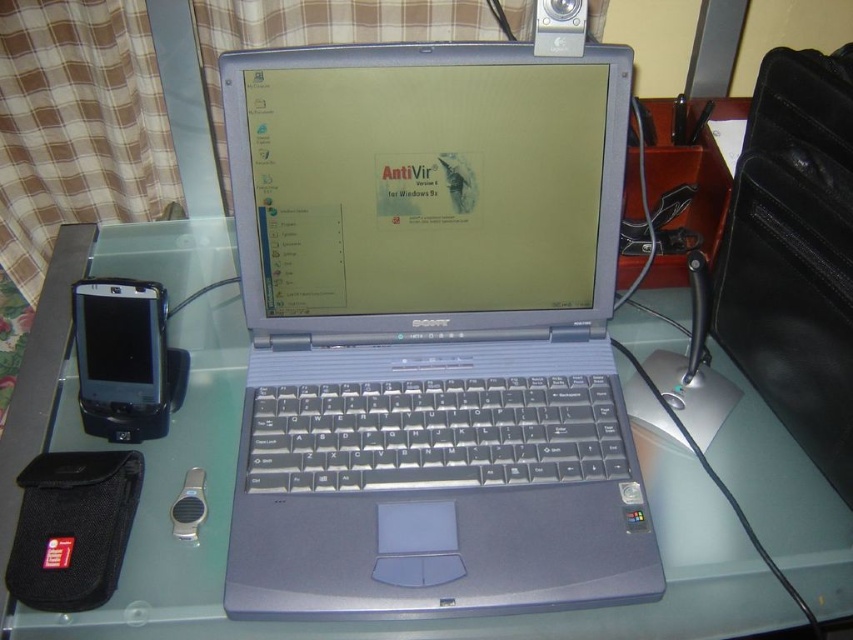
You are setting up a new monitor that requires 15 cm of vertical space. Based on the workspace shown, will the silver metallic laptop at center and the clear glass table at center provide enough vertical clearance?

The silver metallic laptop at center is much taller than the clear glass table at center. Since the laptop is taller, it may occupy more vertical space, leaving less clearance for the monitor. However, the exact dimensions are not provided, so it is uncertain if the 15 cm requirement is met. Further measurements would be needed.

You are a delivery robot with a package that is 6 inches wide. You need to place it between the silver metallic laptop at center and the clear glass table at center. Is there enough space?

The distance between the silver metallic laptop at center and the clear glass table at center is 5.28 inches. Since the package is 6 inches wide, which is wider than the available space, the robot cannot place the package between them.

What are the coordinates of the silver metallic laptop at center in the image?

The silver metallic laptop at center is located at coordinates point (430, 332).